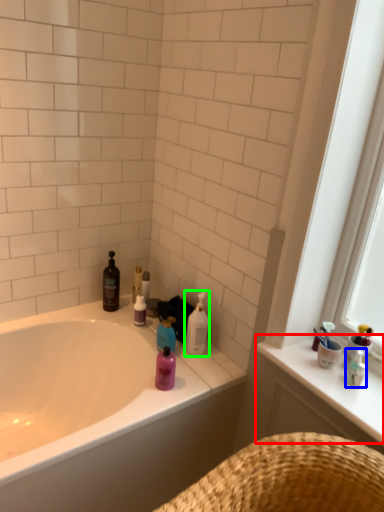
Question: Which object is the closest to the counter top (highlighted by a red box)? Choose among these: toiletry (highlighted by a blue box) or cleaning product (highlighted by a green box).

Choices:
 (A) toiletry
 (B) cleaning product

Answer: (A)